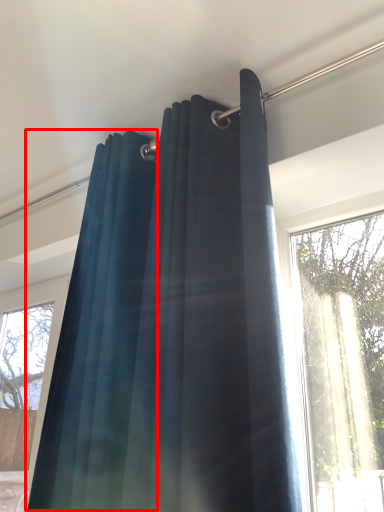
Question: From the image's perspective, where is shower curtain (annotated by the red box) located relative to curtain?

Choices:
 (A) below
 (B) above

Answer: (A)